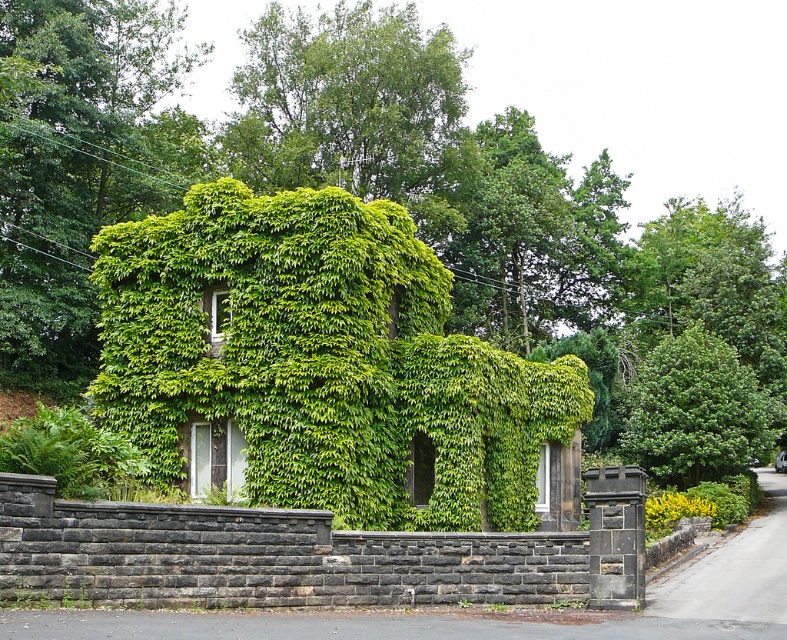
You are standing in front of the house and want to locate the green leafy ivy at upper left. Where exactly is it positioned relative to the house?

The green leafy ivy at upper left is positioned at coordinates point (80, 164) relative to the house.

You are a gardener assessing the vegetation around the house. You need to determine which of the two plants, the green leafy ivy at upper left or the green leafy tree at right, has a larger spread. Based on the scene, can you tell which one is wider?

The green leafy ivy at upper left might be wider than green leafy tree at right according to the description.

You are a gardener planning to trim both the green leafy ivy at upper left and the green leafy tree at right. Given that you can only carry your tools for a maximum distance of 25 meters before needing to return to the shed, will you be able to reach both plants without needing to return to the shed?

The green leafy ivy at upper left and the green leafy tree at right are 26.84 meters apart, which is longer than your 25 meter tool carrying limit. You will need to return to the shed after trimming one of them to get fresh tools before moving to the other.